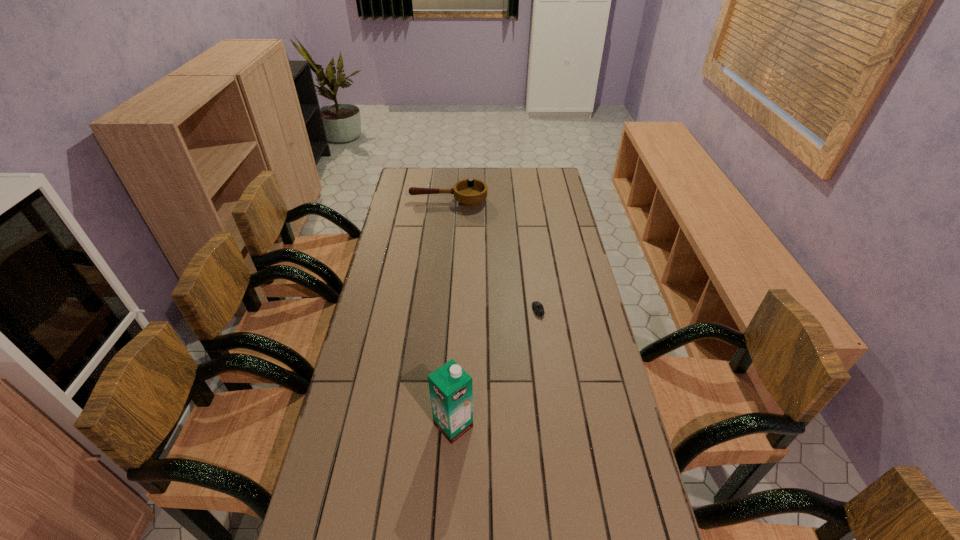
I want to click on object that is at the far left corner, so click(x=469, y=193).

You are a GUI agent. You are given a task and a screenshot of the screen. Output one action in this format:
    pyautogui.click(x=<x>, y=<y>)
    Task: Click on the vacant area at the far edge
    This screenshot has width=960, height=540.
    Given the screenshot: What is the action you would take?
    pyautogui.click(x=468, y=170)

Find the location of a particular element. The height and width of the screenshot is (540, 960). vacant area at the left edge of the desktop is located at coordinates (383, 256).

You are a GUI agent. You are given a task and a screenshot of the screen. Output one action in this format:
    pyautogui.click(x=<x>, y=<y>)
    Task: Click on the vacant space at the right edge
    This screenshot has height=540, width=960.
    Given the screenshot: What is the action you would take?
    pyautogui.click(x=553, y=234)

This screenshot has height=540, width=960. Identify the location of vacant space at the far left corner of the desktop. (410, 174).

The width and height of the screenshot is (960, 540). In the image, there is a desktop. Identify the location of vacant space at the far right corner. (530, 181).

Find the location of a particular element. unoccupied area between the second shortest object and the tallest object is located at coordinates (451, 313).

Find the location of a particular element. The image size is (960, 540). vacant space that's between the saucepan and the tallest object is located at coordinates click(x=451, y=313).

This screenshot has width=960, height=540. Find the location of `free space that is in between the second tallest object and the rightmost object`. free space that is in between the second tallest object and the rightmost object is located at coordinates (493, 256).

Identify the location of vacant space in between the computer mouse and the carton. (495, 368).